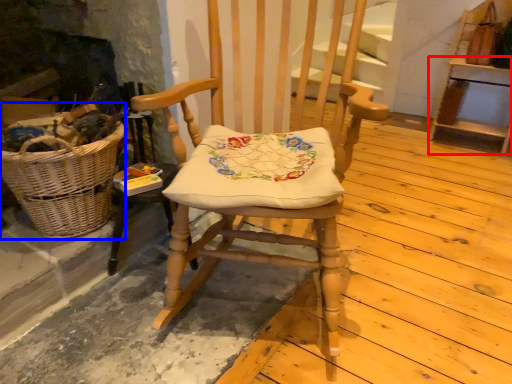
Question: Which of the following is the farthest to the observer, furniture (highlighted by a red box) or picnic basket (highlighted by a blue box)?

Choices:
 (A) furniture
 (B) picnic basket

Answer: (A)